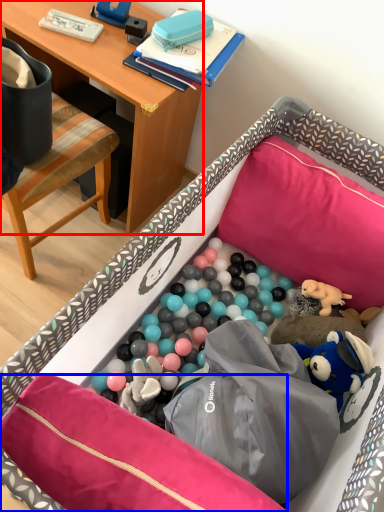
Question: Which object is further to the camera taking this photo, desk (highlighted by a red box) or pillow (highlighted by a blue box)?

Choices:
 (A) desk
 (B) pillow

Answer: (A)